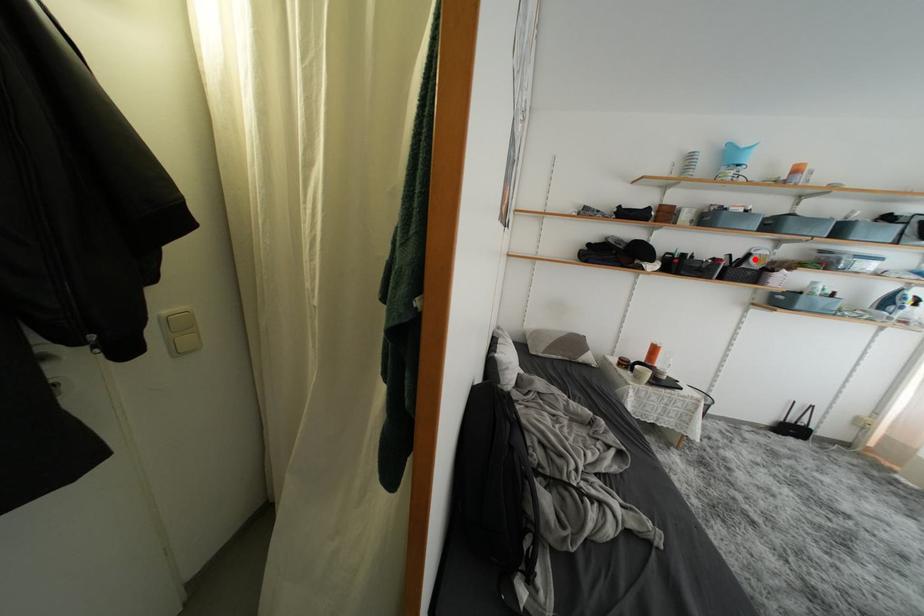
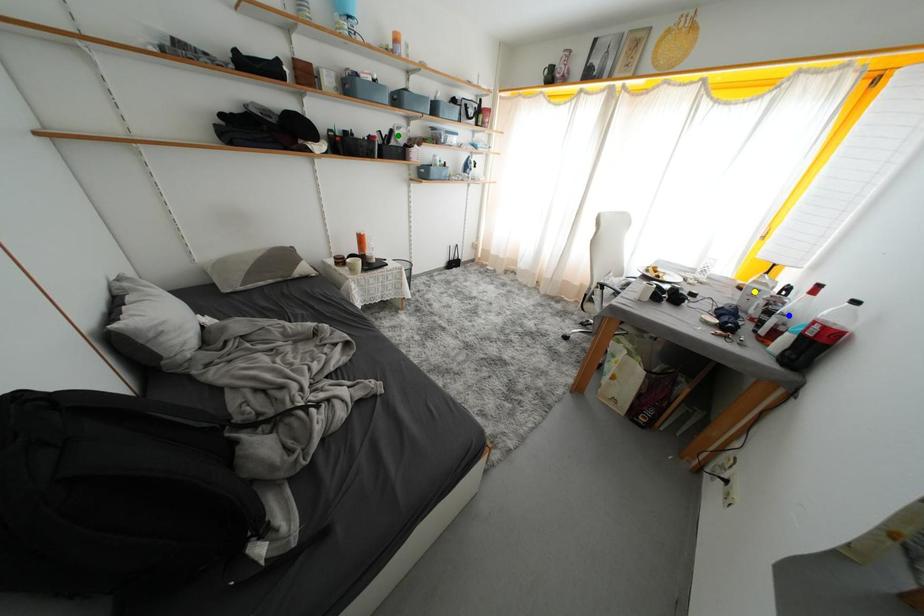
Question: I am providing you with two images of the same scene from different viewpoints. A red point is marked on the first image. You are given multiple points on the second image. Can you choose the point in image 2 that corresponds to the point in image 1?

Choices:
 (A) yellow point
 (B) blue point
 (C) green point

Answer: (C)